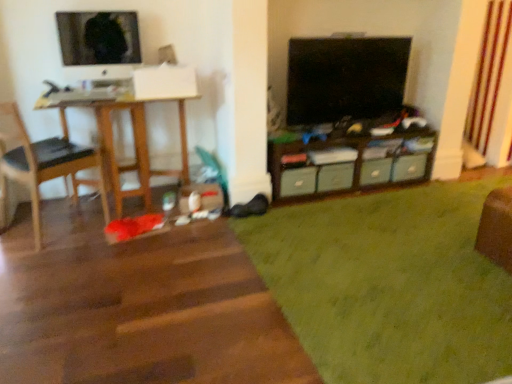
Question: Is green shag rug at lower right closer to the viewer compared to wooden cabinet at center?

Choices:
 (A) no
 (B) yes

Answer: (B)

Question: From the image's perspective, is green shag rug at lower right on top of wooden cabinet at center?

Choices:
 (A) yes
 (B) no

Answer: (B)

Question: From the image's perspective, is green shag rug at lower right under wooden cabinet at center?

Choices:
 (A) no
 (B) yes

Answer: (B)

Question: Does green shag rug at lower right have a smaller size compared to wooden cabinet at center?

Choices:
 (A) yes
 (B) no

Answer: (B)

Question: Considering the relative sizes of green shag rug at lower right and wooden cabinet at center in the image provided, is green shag rug at lower right taller than wooden cabinet at center?

Choices:
 (A) no
 (B) yes

Answer: (A)

Question: Is matte black monitor at upper left, which is the 2th television from right to left, to the left or to the right of green shag rug at lower right in the image?

Choices:
 (A) right
 (B) left

Answer: (B)

Question: From the image's perspective, is matte black monitor at upper left, the 1th television positioned from the left, located above or below green shag rug at lower right?

Choices:
 (A) below
 (B) above

Answer: (B)

Question: From a real-world perspective, is matte black monitor at upper left, which is the 2th television from right to left, positioned above or below green shag rug at lower right?

Choices:
 (A) above
 (B) below

Answer: (A)

Question: Considering the positions of matte black monitor at upper left, which is the 2th television from right to left, and green shag rug at lower right in the image, is matte black monitor at upper left, which is the 2th television from right to left, wider or thinner than green shag rug at lower right?

Choices:
 (A) wide
 (B) thin

Answer: (B)

Question: From a real-world perspective, is green fabric drawer at center, the 3th drawer from the right, above or below matte plastic drawer at center, marked as the 4th drawer in a left-to-right arrangement?

Choices:
 (A) above
 (B) below

Answer: (A)

Question: Is green fabric drawer at center, the 3th drawer from the right, inside the boundaries of matte plastic drawer at center, which is the 1th drawer in right-to-left order, or outside?

Choices:
 (A) inside
 (B) outside

Answer: (B)

Question: From the image's perspective, relative to matte plastic drawer at center, which is the 1th drawer in right-to-left order, is green fabric drawer at center, the second drawer when ordered from left to right, above or below?

Choices:
 (A) above
 (B) below

Answer: (B)

Question: Considering the positions of green fabric drawer at center, the 3th drawer from the right, and matte plastic drawer at center, marked as the 4th drawer in a left-to-right arrangement, in the image, is green fabric drawer at center, the 3th drawer from the right, wider or thinner than matte plastic drawer at center, marked as the 4th drawer in a left-to-right arrangement,?

Choices:
 (A) wide
 (B) thin

Answer: (A)

Question: Looking at their shapes, would you say green matte drawer at center, which is the 4th drawer in right-to-left order, is wider or thinner than black leather chair at left?

Choices:
 (A) thin
 (B) wide

Answer: (A)

Question: Considering their positions, is green matte drawer at center, which is the 4th drawer in right-to-left order, located in front of or behind black leather chair at left?

Choices:
 (A) behind
 (B) front

Answer: (A)